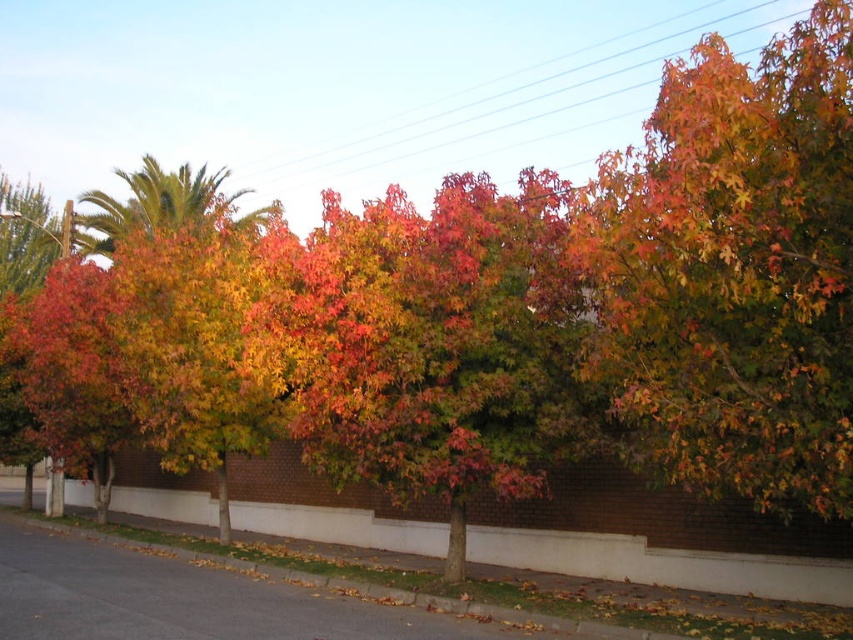
Can you confirm if multicolored foliage at upper right is bigger than white concrete curb at lower center?

Yes, multicolored foliage at upper right is bigger than white concrete curb at lower center.

Based on the photo, who is lower down, multicolored foliage at upper right or white concrete curb at lower center?

white concrete curb at lower center is below.

Who is more distant from viewer, (819, 388) or (479, 538)?

Positioned behind is point (479, 538).

Where is `multicolored foliage at upper right`? The image size is (853, 640). multicolored foliage at upper right is located at coordinates (735, 269).

Looking at this image, is shiny red leaves at center positioned behind white concrete curb at lower center?

No, shiny red leaves at center is closer to the viewer.

This screenshot has height=640, width=853. Find the location of `shiny red leaves at center`. shiny red leaves at center is located at coordinates [434, 342].

Identify the location of shiny red leaves at center. (434, 342).

Can you confirm if multicolored foliage at upper right is thinner than shiny red leaves at center?

No, multicolored foliage at upper right is not thinner than shiny red leaves at center.

This screenshot has width=853, height=640. What do you see at coordinates (735, 269) in the screenshot?
I see `multicolored foliage at upper right` at bounding box center [735, 269].

Identify the location of multicolored foliage at upper right. This screenshot has width=853, height=640. (735, 269).